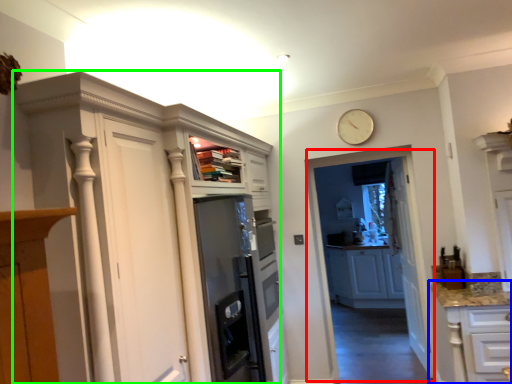
Question: Considering the real-world distances, which object is closest to glass door (highlighted by a red box)? cabinetry (highlighted by a blue box) or cupboard (highlighted by a green box).

Choices:
 (A) cabinetry
 (B) cupboard

Answer: (A)